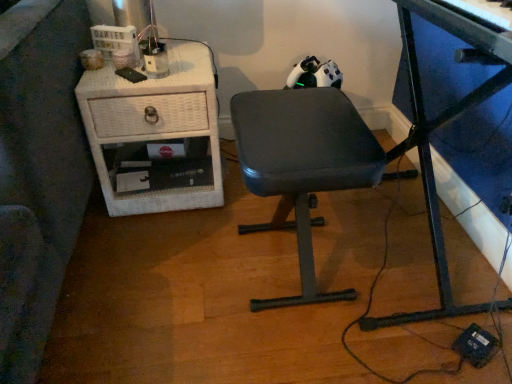
At what (x,y) coordinates should I click in order to perform the action: click on blank area to the left of metallic blue desk at center. Please return your answer as a coordinate pair (x, y). Looking at the image, I should click on (199, 275).